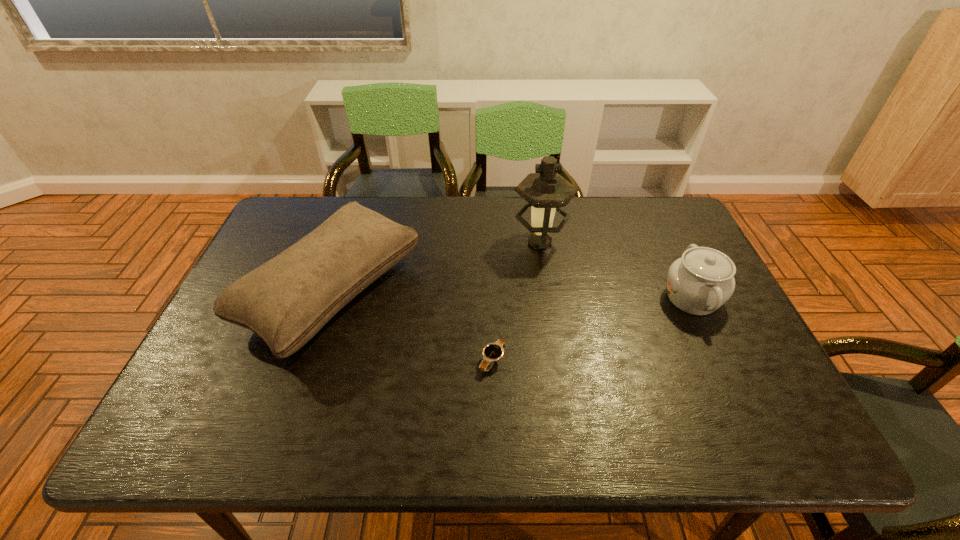
You are a GUI agent. You are given a task and a screenshot of the screen. Output one action in this format:
    pyautogui.click(x=<x>, y=<y>)
    Task: Click on the oil lamp present at the far edge
    
    Given the screenshot: What is the action you would take?
    pyautogui.click(x=545, y=191)

Where is `cushion that is positioned at the far edge`? cushion that is positioned at the far edge is located at coordinates (286, 301).

Where is `object at the left edge`? The image size is (960, 540). object at the left edge is located at coordinates (286, 301).

Where is `object located at the right edge`? The height and width of the screenshot is (540, 960). object located at the right edge is located at coordinates (702, 280).

This screenshot has height=540, width=960. What are the coordinates of `object present at the far left corner` in the screenshot? It's located at (286, 301).

In the image, there is a desktop. At what (x,y) coordinates should I click in order to perform the action: click on free space at the far edge. Please return your answer as a coordinate pair (x, y). This screenshot has height=540, width=960. Looking at the image, I should click on (490, 199).

Locate an element on the screen. vacant area at the near edge of the desktop is located at coordinates (553, 430).

In the image, there is a desktop. Where is `vacant space at the right edge`? This screenshot has width=960, height=540. vacant space at the right edge is located at coordinates (761, 365).

This screenshot has width=960, height=540. In the image, there is a desktop. Find the location of `vacant area at the far right corner`. vacant area at the far right corner is located at coordinates (647, 230).

Locate an element on the screen. The height and width of the screenshot is (540, 960). vacant area that lies between the tallest object and the rightmost object is located at coordinates (616, 271).